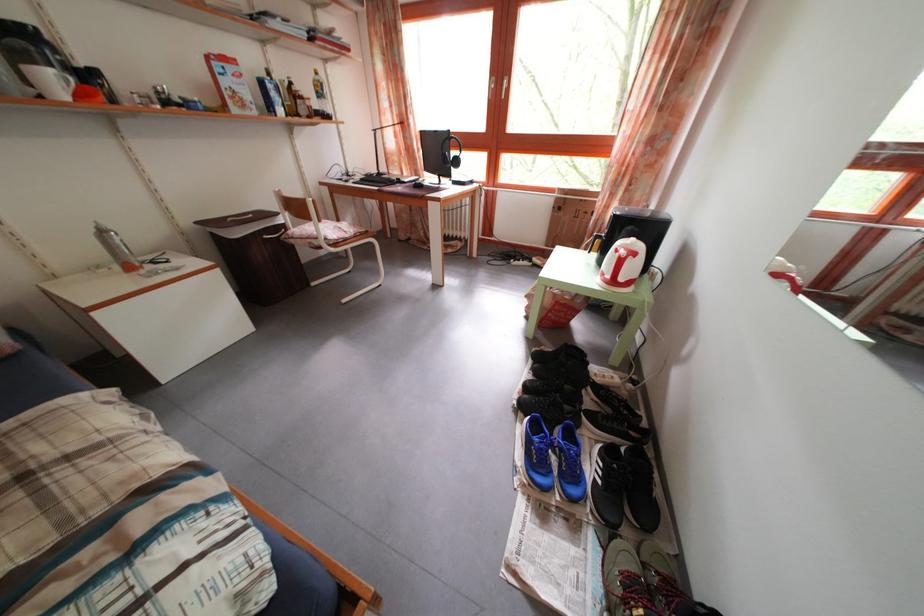
Locate an element on the screen. The width and height of the screenshot is (924, 616). red kettle handle is located at coordinates (629, 256).